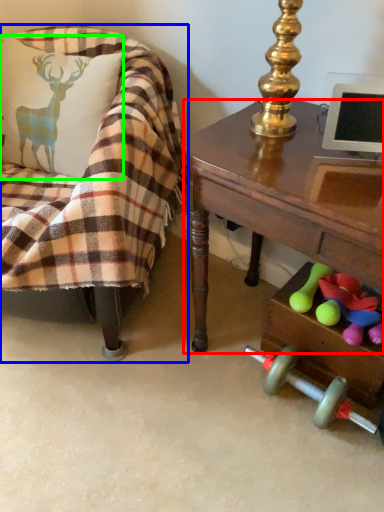
Question: Estimate the real-world distances between objects in this image. Which object is farther from desk (highlighted by a red box), chair (highlighted by a blue box) or pillow (highlighted by a green box)?

Choices:
 (A) chair
 (B) pillow

Answer: (B)